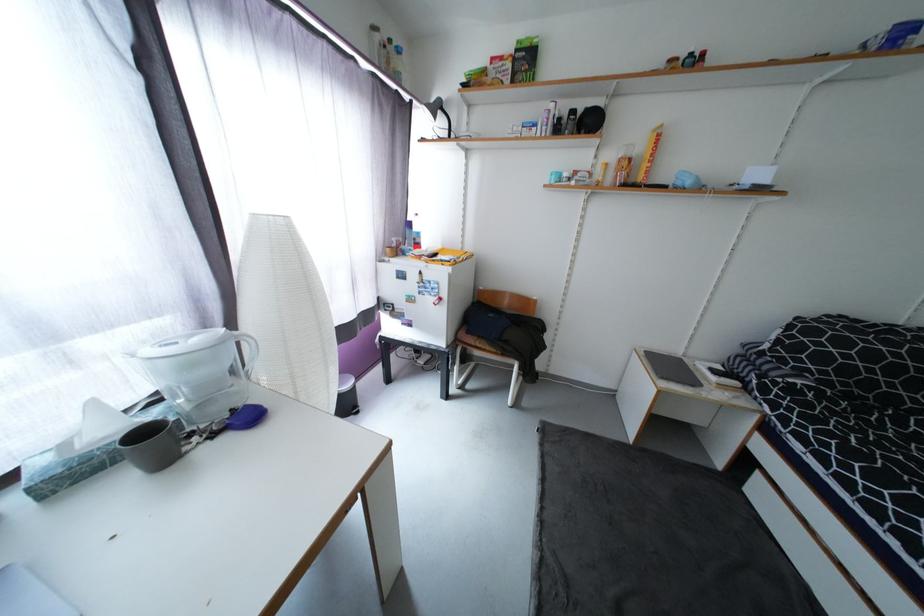
In order to click on water pitcher handle in this screenshot , I will do `click(247, 351)`.